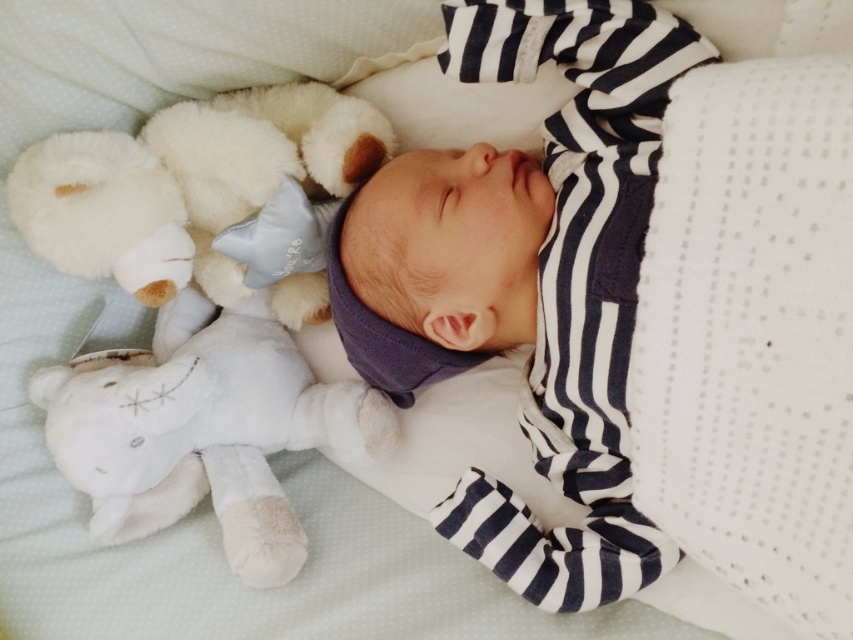
Question: Which of the following is the closest to the observer?

Choices:
 (A) (283, 134)
 (B) (193, 380)

Answer: (B)

Question: Can you confirm if white plush bear at upper left is thinner than white plush teddy bear at upper left?

Choices:
 (A) no
 (B) yes

Answer: (A)

Question: Which object is closer to the camera taking this photo?

Choices:
 (A) white plush bear at upper left
 (B) white plush teddy bear at upper left

Answer: (B)

Question: Does white plush bear at upper left come behind white plush teddy bear at upper left?

Choices:
 (A) no
 (B) yes

Answer: (B)

Question: Does white plush bear at upper left have a smaller size compared to white plush teddy bear at upper left?

Choices:
 (A) no
 (B) yes

Answer: (A)